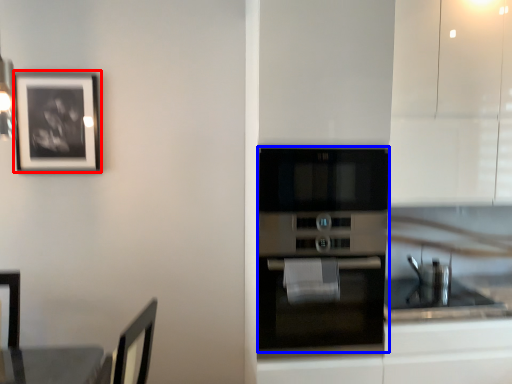
Question: Which object appears farthest to the camera in this image, picture frame (highlighted by a red box) or oven (highlighted by a blue box)?

Choices:
 (A) picture frame
 (B) oven

Answer: (A)